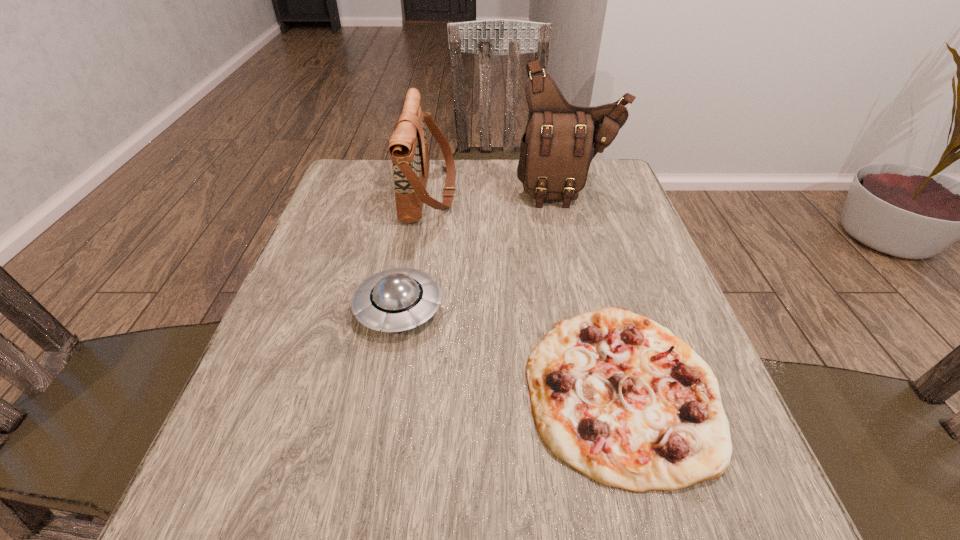
The image size is (960, 540). In the image, there is a desktop. What are the coordinates of `vacant region at the far left corner` in the screenshot? It's located at (349, 158).

Identify the location of free space at the near left corner of the desktop. This screenshot has width=960, height=540. (191, 517).

Where is `blank area at the far right corner`? blank area at the far right corner is located at coordinates (606, 181).

Where is `vacant area at the near right corner of the desktop`? vacant area at the near right corner of the desktop is located at coordinates 740,512.

Find the location of a particular element. This screenshot has height=540, width=960. free space between the pizza and the right shoulder bag is located at coordinates (595, 290).

Locate an element on the screen. vacant point located between the second shortest object and the right shoulder bag is located at coordinates (483, 249).

The image size is (960, 540). I want to click on vacant space that's between the pizza and the right shoulder bag, so click(595, 290).

Where is `empty space between the pizza and the shorter shoulder bag`? Image resolution: width=960 pixels, height=540 pixels. empty space between the pizza and the shorter shoulder bag is located at coordinates (526, 290).

Where is `free spot between the left shoulder bag and the shortest object`? This screenshot has width=960, height=540. free spot between the left shoulder bag and the shortest object is located at coordinates (526, 290).

Find the location of a particular element. This screenshot has height=540, width=960. free spot between the shortest object and the second shortest object is located at coordinates (511, 348).